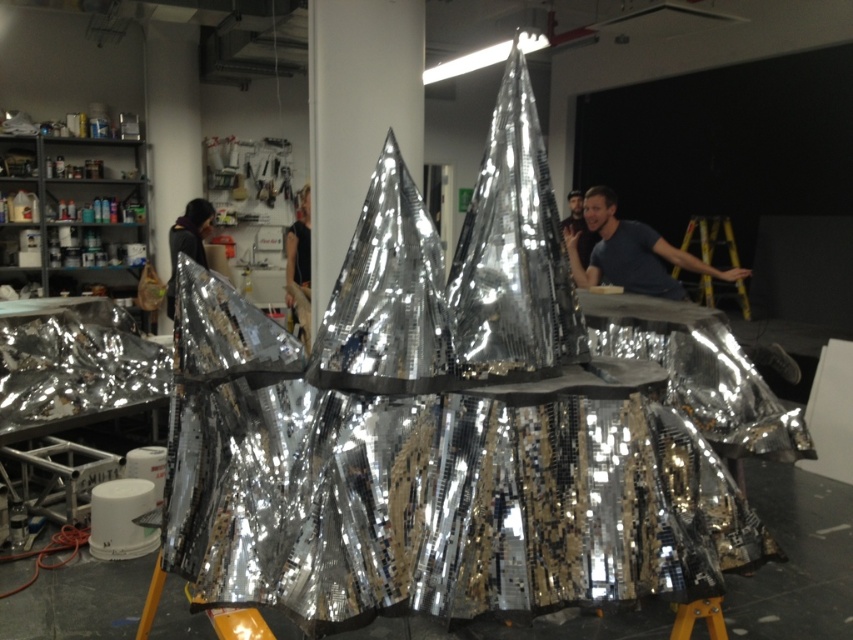
You are an artist in the studio and need to place a new sculpture between the metallic silver jacket at center and the dark brown leather jacket at center. According to their positions, which jacket should the sculpture be placed to the left of?

The metallic silver jacket at center is positioned on the right side of dark brown leather jacket at center, so the sculpture should be placed to the left of the metallic silver jacket at center.